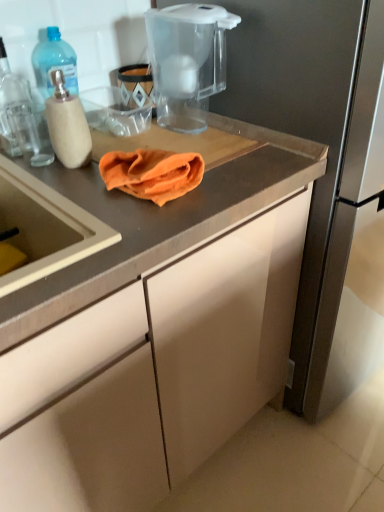
Identify the location of orange cloth at center. (152, 173).

Describe the element at coordinates (152, 173) in the screenshot. The height and width of the screenshot is (512, 384). I see `orange cloth at center` at that location.

Describe the element at coordinates (152, 373) in the screenshot. The height and width of the screenshot is (512, 384). I see `matte gray cabinet at center` at that location.

The height and width of the screenshot is (512, 384). What do you see at coordinates (187, 60) in the screenshot?
I see `transparent plastic water filter pitcher at upper center` at bounding box center [187, 60].

Measure the distance between point (12,91) and camera.

They are 38.15 inches apart.

The image size is (384, 512). What are the coordinates of `translucent plastic bottle at left` in the screenshot? It's located at (21, 118).

The image size is (384, 512). I want to click on orange cloth at center, so click(152, 173).

From the image's perspective, between transparent plastic water filter pitcher at upper center and orange cloth at center, which one is located above?

From the image's view, transparent plastic water filter pitcher at upper center is above.

Does point (178, 106) lie in front of point (123, 157)?

No, (178, 106) is further to viewer.

Identify the location of home appliance that appears above the orange cloth at center (from the image's perspective). (187, 60).

Can you confirm if transparent plastic water filter pitcher at upper center is smaller than orange cloth at center?

No, transparent plastic water filter pitcher at upper center is not smaller than orange cloth at center.

From the image's perspective, is orange cloth at center above matte gray cabinet at center?

Yes, from the image's perspective, orange cloth at center is above matte gray cabinet at center.

Who is more distant, orange cloth at center or matte gray cabinet at center?

orange cloth at center is more distant.

Can you confirm if orange cloth at center is positioned to the right of matte gray cabinet at center?

Correct, you'll find orange cloth at center to the right of matte gray cabinet at center.

How different are the orientations of orange cloth at center and matte gray cabinet at center in degrees?

The angle between the facing direction of orange cloth at center and the facing direction of matte gray cabinet at center is 0.048 degrees.

In the image, is matte gray cabinet at center positioned in front of or behind orange cloth at center?

Visually, matte gray cabinet at center is located in front of orange cloth at center.

Can we say matte gray cabinet at center lies outside orange cloth at center?

That's correct, matte gray cabinet at center is outside of orange cloth at center.

Does matte gray cabinet at center have a smaller size compared to orange cloth at center?

No, matte gray cabinet at center is not smaller than orange cloth at center.

Which of these two, transparent plastic water filter pitcher at upper center or matte gray cabinet at center, is thinner?

transparent plastic water filter pitcher at upper center is thinner.

Which object is further away from the camera, transparent plastic water filter pitcher at upper center or matte gray cabinet at center?

transparent plastic water filter pitcher at upper center is further away from the camera.

The height and width of the screenshot is (512, 384). What are the coordinates of `cabinetry that appears below the transparent plastic water filter pitcher at upper center (from the image's perspective)` in the screenshot? It's located at (152, 373).

Considering the sizes of translucent plastic bottle at left and orange cloth at center in the image, is translucent plastic bottle at left wider or thinner than orange cloth at center?

In the image, translucent plastic bottle at left appears to be more narrow than orange cloth at center.

Is translucent plastic bottle at left shorter than orange cloth at center?

Incorrect, the height of translucent plastic bottle at left does not fall short of that of orange cloth at center.

From a real-world perspective, does translucent plastic bottle at left stand above orange cloth at center?

Yes, from a real-world perspective, translucent plastic bottle at left is over orange cloth at center

Is translucent plastic bottle at left aimed at orange cloth at center?

Yes, translucent plastic bottle at left is turned towards orange cloth at center.

Consider the image. Does translucent plastic bottle at left have a greater width compared to transparent plastic water filter pitcher at upper center?

In fact, translucent plastic bottle at left might be narrower than transparent plastic water filter pitcher at upper center.

Can you tell me how much translucent plastic bottle at left and transparent plastic water filter pitcher at upper center differ in facing direction?

1.45 degrees separate the facing orientations of translucent plastic bottle at left and transparent plastic water filter pitcher at upper center.

From the image's perspective, is translucent plastic bottle at left over transparent plastic water filter pitcher at upper center?

No, from the image's perspective, translucent plastic bottle at left is not over transparent plastic water filter pitcher at upper center.

Identify the location of kitchen appliance below the transparent plastic water filter pitcher at upper center (from a real-world perspective). This screenshot has height=512, width=384. (21, 118).

Considering the relative sizes of orange cloth at center and transparent plastic water filter pitcher at upper center in the image provided, is orange cloth at center smaller than transparent plastic water filter pitcher at upper center?

Yes, orange cloth at center is smaller than transparent plastic water filter pitcher at upper center.

Is orange cloth at center in front of or behind transparent plastic water filter pitcher at upper center in the image?

Clearly, orange cloth at center is in front of transparent plastic water filter pitcher at upper center.

Is orange cloth at center aimed at transparent plastic water filter pitcher at upper center?

No, orange cloth at center is not facing towards transparent plastic water filter pitcher at upper center.

Considering the sizes of orange cloth at center and transparent plastic water filter pitcher at upper center in the image, is orange cloth at center wider or thinner than transparent plastic water filter pitcher at upper center?

Considering their sizes, orange cloth at center looks slimmer than transparent plastic water filter pitcher at upper center.

In the image, there is a transparent plastic water filter pitcher at upper center. At what (x,y) coordinates should I click in order to perform the action: click on blanket below it (from a real-world perspective). Please return your answer as a coordinate pair (x, y). Looking at the image, I should click on (152, 173).

Where is `cabinetry lying in front of the orange cloth at center`? This screenshot has height=512, width=384. cabinetry lying in front of the orange cloth at center is located at coordinates [x=152, y=373].

Looking at the image, which one is located closer to matte gray cabinet at center, orange cloth at center or translucent plastic bottle at left?

orange cloth at center is positioned closer to the anchor matte gray cabinet at center.

Considering their positions, is orange cloth at center positioned further to translucent plastic bottle at left than matte gray cabinet at center?

matte gray cabinet at center lies further to translucent plastic bottle at left than the other object.

Based on their spatial positions, is transparent plastic water filter pitcher at upper center or matte gray cabinet at center closer to orange cloth at center?

transparent plastic water filter pitcher at upper center.

Which object lies further to the anchor point orange cloth at center, translucent plastic bottle at left or matte gray cabinet at center?

matte gray cabinet at center is further to orange cloth at center.

Based on their spatial positions, is matte gray cabinet at center or orange cloth at center closer to transparent plastic water filter pitcher at upper center?

The object closer to transparent plastic water filter pitcher at upper center is orange cloth at center.

Considering their positions, is matte gray cabinet at center positioned further to orange cloth at center than transparent plastic water filter pitcher at upper center?

The object further to orange cloth at center is matte gray cabinet at center.

Consider the image. When comparing their distances from orange cloth at center, does translucent plastic bottle at left or transparent plastic water filter pitcher at upper center seem further?

Based on the image, transparent plastic water filter pitcher at upper center appears to be further to orange cloth at center.

Estimate the real-world distances between objects in this image. Which object is further from transparent plastic water filter pitcher at upper center, orange cloth at center or translucent plastic bottle at left?

translucent plastic bottle at left is positioned further to the anchor transparent plastic water filter pitcher at upper center.

This screenshot has height=512, width=384. What are the coordinates of `blanket located between translucent plastic bottle at left and transparent plastic water filter pitcher at upper center in the left-right direction` in the screenshot? It's located at (152, 173).

You are a GUI agent. You are given a task and a screenshot of the screen. Output one action in this format:
    pyautogui.click(x=<x>, y=<y>)
    Task: Click on the blanket between transparent plastic water filter pitcher at upper center and matte gray cabinet at center in the up-down direction
    The height and width of the screenshot is (512, 384).
    Given the screenshot: What is the action you would take?
    pyautogui.click(x=152, y=173)

Find the location of a particular element. This screenshot has height=512, width=384. kitchen appliance between transparent plastic water filter pitcher at upper center and matte gray cabinet at center vertically is located at coordinates (21, 118).

Find the location of a particular element. The height and width of the screenshot is (512, 384). blanket that lies between translucent plastic bottle at left and matte gray cabinet at center from top to bottom is located at coordinates (152, 173).